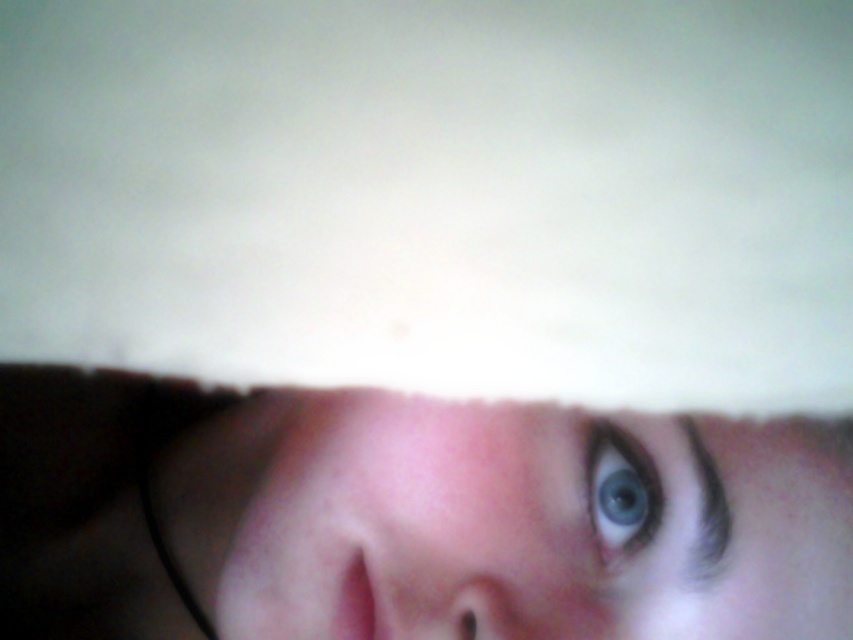
You are a photographer adjusting the lighting for a portrait. You notice the smooth skin face at center and the blue glossy eye at center in your viewfinder. Which object is positioned to the left in the frame?

The smooth skin face at center is positioned to the left of the blue glossy eye at center according to the description.

Based on the photo, you are a photographer adjusting the focus on a camera. You notice the smooth skin face at center and the blue glossy eye at center in your viewfinder. Which part should you focus on to ensure the subject is sharp and in focus?

The blue glossy eye at center should be focused on because it is the most critical feature for capturing a sharp and focused image of the subject.

What are the coordinates of the smooth skin face at center?

The smooth skin face at center is located at coordinates point (541, 528).